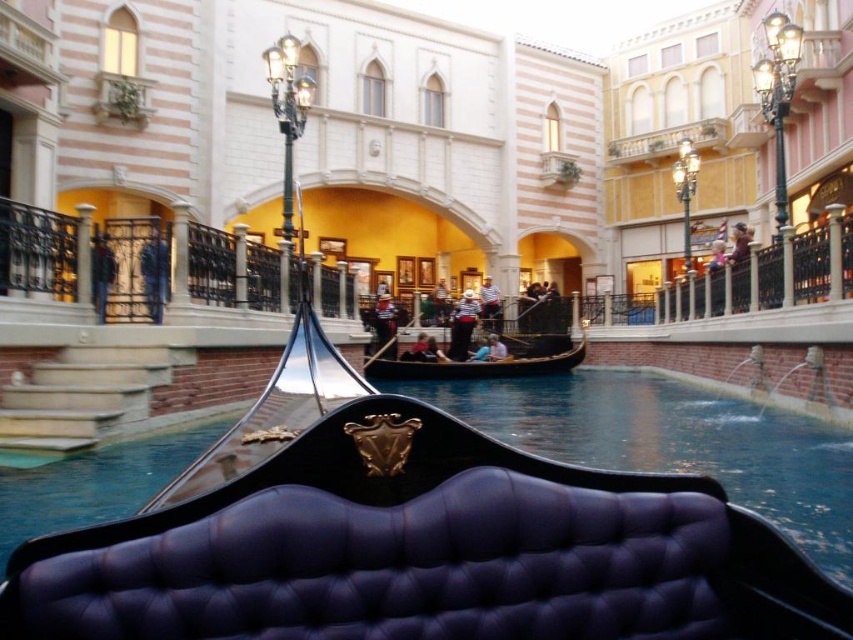
Does black wrought iron railing at upper center have a greater width compared to black polished wood gondola at center?

Correct, the width of black wrought iron railing at upper center exceeds that of black polished wood gondola at center.

I want to click on black wrought iron railing at upper center, so click(x=131, y=266).

The height and width of the screenshot is (640, 853). In order to click on black wrought iron railing at upper center in this screenshot , I will do `click(131, 266)`.

Is glossy black gondola at center in front of black polished wood gondola at center?

Yes.

Is glossy black gondola at center shorter than black polished wood gondola at center?

No, glossy black gondola at center is not shorter than black polished wood gondola at center.

What do you see at coordinates (412, 538) in the screenshot?
I see `glossy black gondola at center` at bounding box center [412, 538].

Find the location of a particular element. This screenshot has width=853, height=640. glossy black gondola at center is located at coordinates (412, 538).

Does point (241, 593) come farther from viewer compared to point (293, 304)?

No, it is in front of (293, 304).

Is glossy black gondola at center to the left of black wrought iron railing at upper center from the viewer's perspective?

In fact, glossy black gondola at center is to the right of black wrought iron railing at upper center.

The image size is (853, 640). Identify the location of glossy black gondola at center. (412, 538).